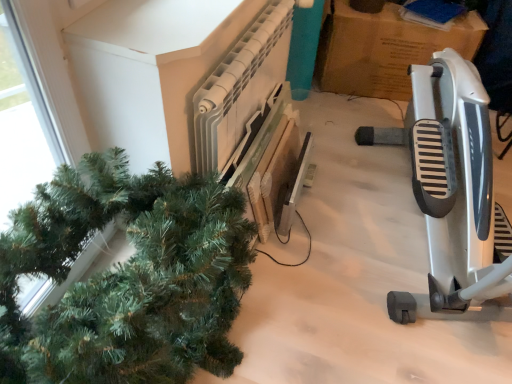
Question: From a real-world perspective, does silver metallic exercise bike at right stand above cardboard at upper right?

Choices:
 (A) yes
 (B) no

Answer: (A)

Question: Does silver metallic exercise bike at right have a lesser height compared to cardboard at upper right?

Choices:
 (A) yes
 (B) no

Answer: (B)

Question: Is silver metallic exercise bike at right at the left side of cardboard at upper right?

Choices:
 (A) no
 (B) yes

Answer: (A)

Question: Is silver metallic exercise bike at right thinner than cardboard at upper right?

Choices:
 (A) no
 (B) yes

Answer: (A)

Question: From the image's perspective, is silver metallic exercise bike at right over cardboard at upper right?

Choices:
 (A) yes
 (B) no

Answer: (B)

Question: Considering the relative sizes of silver metallic exercise bike at right and cardboard at upper right in the image provided, is silver metallic exercise bike at right taller than cardboard at upper right?

Choices:
 (A) no
 (B) yes

Answer: (B)

Question: Can you confirm if cardboard at upper right is positioned to the right of green matte christmas tree at left?

Choices:
 (A) no
 (B) yes

Answer: (B)

Question: Considering the relative sizes of cardboard at upper right and green matte christmas tree at left in the image provided, is cardboard at upper right shorter than green matte christmas tree at left?

Choices:
 (A) no
 (B) yes

Answer: (B)

Question: Is the depth of cardboard at upper right less than that of green matte christmas tree at left?

Choices:
 (A) no
 (B) yes

Answer: (A)

Question: Is cardboard at upper right taller than green matte christmas tree at left?

Choices:
 (A) yes
 (B) no

Answer: (B)

Question: From a real-world perspective, is cardboard at upper right beneath green matte christmas tree at left?

Choices:
 (A) yes
 (B) no

Answer: (A)

Question: Are cardboard at upper right and green matte christmas tree at left making contact?

Choices:
 (A) yes
 (B) no

Answer: (B)

Question: Would you say white plastic radiator at upper center is a long distance from green matte christmas tree at left?

Choices:
 (A) no
 (B) yes

Answer: (A)